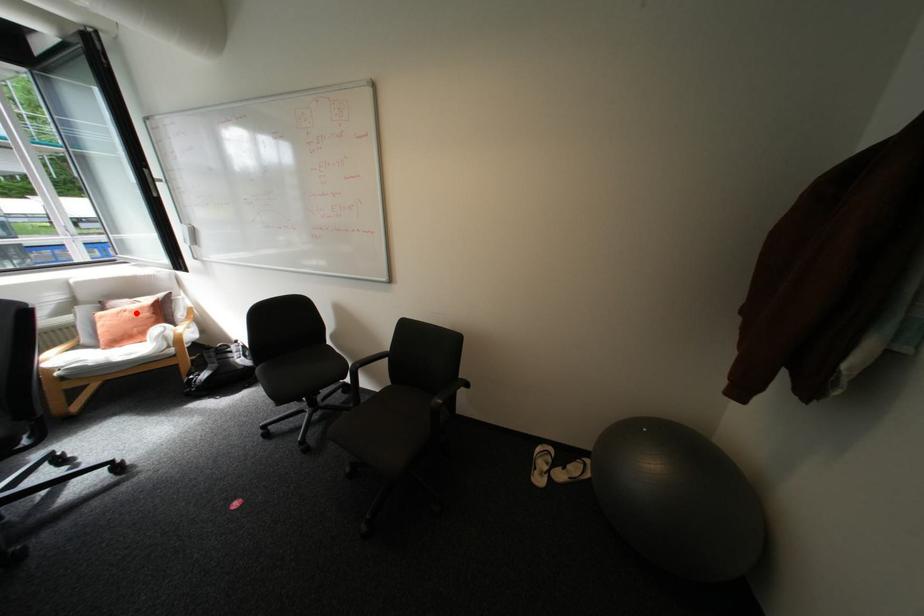
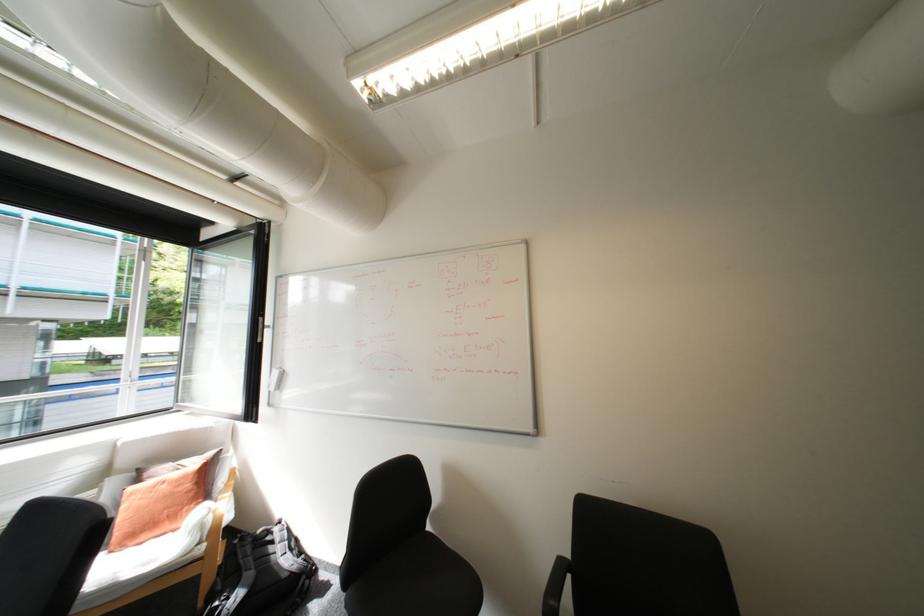
Question: I am providing you with two images of the same scene from different viewpoints. A red point is marked on the first image. Is the red point's position out of view in image 2?

Choices:
 (A) Yes
 (B) No

Answer: (B)